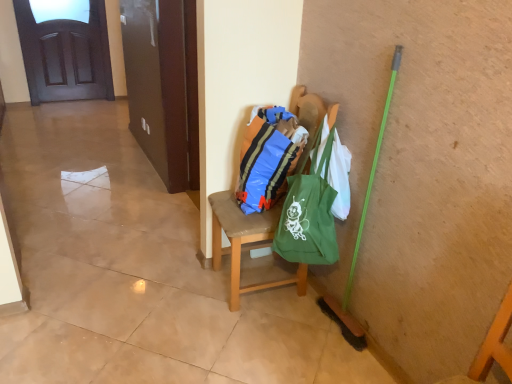
Measure the distance between point (x=350, y=152) and camera.

Point (x=350, y=152) and camera are 5.92 feet apart from each other.

What do you see at coordinates (340, 177) in the screenshot?
I see `green fabric bag at center` at bounding box center [340, 177].

What do you see at coordinates (268, 157) in the screenshot?
I see `blue plastic bag at center` at bounding box center [268, 157].

The image size is (512, 384). What do you see at coordinates (309, 213) in the screenshot?
I see `green canvas tote at center` at bounding box center [309, 213].

Identify the location of green fabric bag at center. (340, 177).

Is green fabric bag at center looking in the opposite direction of green fabric bag at center?

No.

Considering the positions of objects green fabric bag at center and green fabric bag at center in the image provided, who is more to the right, green fabric bag at center or green fabric bag at center?

green fabric bag at center is more to the right.

Looking at this image, in terms of size, does green fabric bag at center appear bigger or smaller than green fabric bag at center?

In the image, green fabric bag at center appears to be larger than green fabric bag at center.

Considering the positions of points (225, 219) and (333, 182), is point (225, 219) closer to camera compared to point (333, 182)?

That is False.

From a real-world perspective, relative to green fabric bag at center, is green canvas tote at center vertically above or below?

Clearly, from a real-world perspective, green canvas tote at center is above green fabric bag at center.

Between point (309, 241) and point (224, 193), which one is positioned in front?

Positioned in front is point (309, 241).

How many degrees apart are the facing directions of green canvas tote at center and green fabric bag at center?

There is a 47.8-degree angle between the facing directions of green canvas tote at center and green fabric bag at center.

Is green canvas tote at center thinner than green fabric bag at center?

Correct, the width of green canvas tote at center is less than that of green fabric bag at center.

Is point (262, 126) closer to camera compared to point (241, 220)?

Yes, it is.

Considering the relative sizes of blue plastic bag at center and green fabric bag at center in the image provided, is blue plastic bag at center taller than green fabric bag at center?

No.

From the image's perspective, would you say blue plastic bag at center is positioned over green fabric bag at center?

Yes, from the image's perspective, blue plastic bag at center is on top of green fabric bag at center.

Who is more distant, blue plastic bag at center or green fabric bag at center?

blue plastic bag at center is behind.

Looking at this image, is dark wood door at upper left positioned with its back to blue plastic bag at center?

dark wood door at upper left is not turned away from blue plastic bag at center.

Is dark wood door at upper left directly adjacent to blue plastic bag at center?

No.

From a real-world perspective, who is located lower, dark wood door at upper left or blue plastic bag at center?

In real-world perspective, dark wood door at upper left is lower.

This screenshot has width=512, height=384. Identify the location of shopping bag located above the dark wood door at upper left (from a real-world perspective). (268, 157).

From the image's perspective, is blue plastic bag at center beneath dark wood door at upper left?

Yes.

Is point (289, 114) positioned behind point (62, 94)?

No, (289, 114) is closer to viewer.

Consider the image. Between dark wood door at upper left and green canvas tote at center, which one appears on the right side from the viewer's perspective?

From the viewer's perspective, green canvas tote at center appears more on the right side.

Can green canvas tote at center be found inside dark wood door at upper left?

That's incorrect, green canvas tote at center is not inside dark wood door at upper left.

Is dark wood door at upper left aimed at green canvas tote at center?

Yes, dark wood door at upper left is facing green canvas tote at center.

Is green canvas tote at center not inside green fabric bag at center?

Yes, green canvas tote at center is located beyond the bounds of green fabric bag at center.

Is point (337, 245) positioned behind point (343, 174)?

Yes, it is.

Does green canvas tote at center turn towards green fabric bag at center?

Yes, green canvas tote at center is turned towards green fabric bag at center.

Is green canvas tote at center further to the viewer compared to green fabric bag at center?

No, it is not.

Find the location of a particular element. This screenshot has width=512, height=384. chair below the green fabric bag at center (from a real-world perspective) is located at coordinates (245, 243).

Identify the location of chair that is on the left side of green canvas tote at center. The height and width of the screenshot is (384, 512). (245, 243).

Estimate the real-world distances between objects in this image. Which object is further from dark wood door at upper left, green canvas tote at center or green fabric bag at center?

Among the two, green canvas tote at center is located further to dark wood door at upper left.

Which object lies nearer to the anchor point green fabric bag at center, dark wood door at upper left or blue plastic bag at center?

blue plastic bag at center is positioned closer to the anchor green fabric bag at center.

Based on the photo, looking at the image, which one is located further to dark wood door at upper left, green fabric bag at center or blue plastic bag at center?

green fabric bag at center lies further to dark wood door at upper left than the other object.

Based on their spatial positions, is blue plastic bag at center or green canvas tote at center closer to green fabric bag at center?

blue plastic bag at center is positioned closer to the anchor green fabric bag at center.

Looking at the image, which one is located closer to green fabric bag at center, green fabric bag at center or blue plastic bag at center?

blue plastic bag at center lies closer to green fabric bag at center than the other object.

Estimate the real-world distances between objects in this image. Which object is closer to blue plastic bag at center, green fabric bag at center or dark wood door at upper left?

Among the two, green fabric bag at center is located nearer to blue plastic bag at center.

From the image, which object appears to be farther from green fabric bag at center, green canvas tote at center or green fabric bag at center?

green fabric bag at center is further to green fabric bag at center.

Estimate the real-world distances between objects in this image. Which object is further from green fabric bag at center, green fabric bag at center or green canvas tote at center?

green fabric bag at center.

I want to click on shoulder bag situated between blue plastic bag at center and green fabric bag at center from left to right, so pyautogui.click(x=309, y=213).

Where is `grocery bag located between green canvas tote at center and dark wood door at upper left in the depth direction`? This screenshot has height=384, width=512. grocery bag located between green canvas tote at center and dark wood door at upper left in the depth direction is located at coordinates (340, 177).

The height and width of the screenshot is (384, 512). Find the location of `grocery bag between green fabric bag at center and dark wood door at upper left from front to back`. grocery bag between green fabric bag at center and dark wood door at upper left from front to back is located at coordinates (340, 177).

Identify the location of shoulder bag located between green fabric bag at center and green fabric bag at center in the left-right direction. (309, 213).